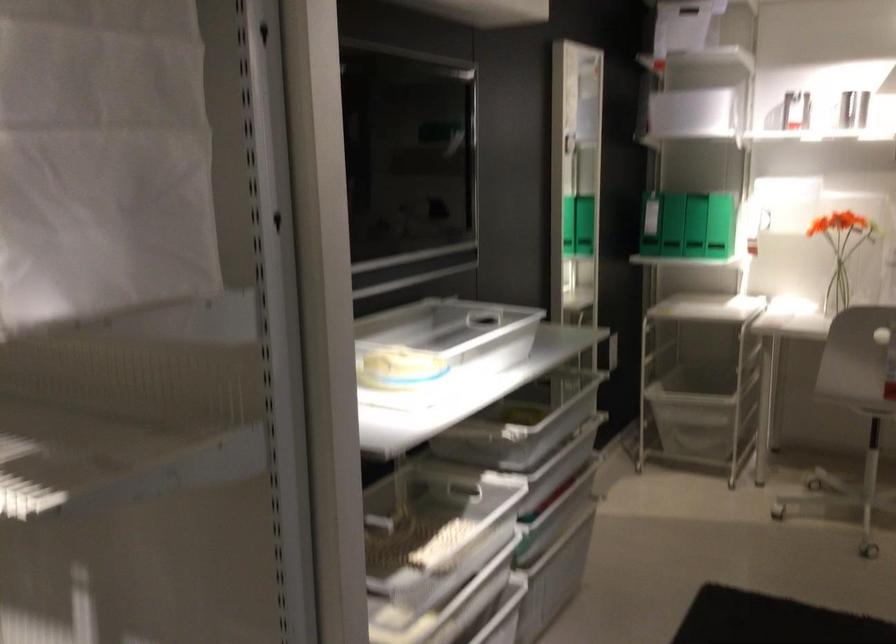
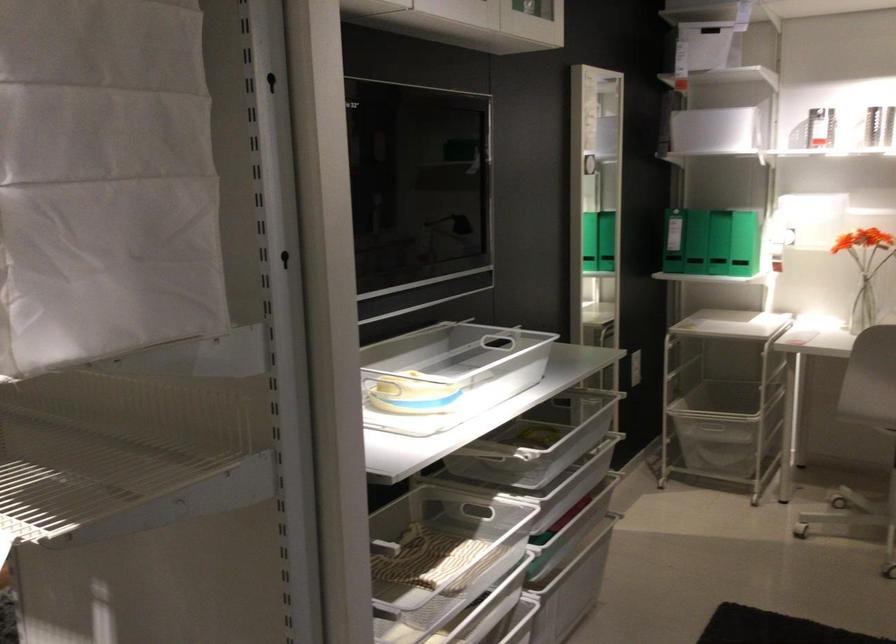
Find the pixel in the second image that matches (x=400, y=366) in the first image.

(409, 392)